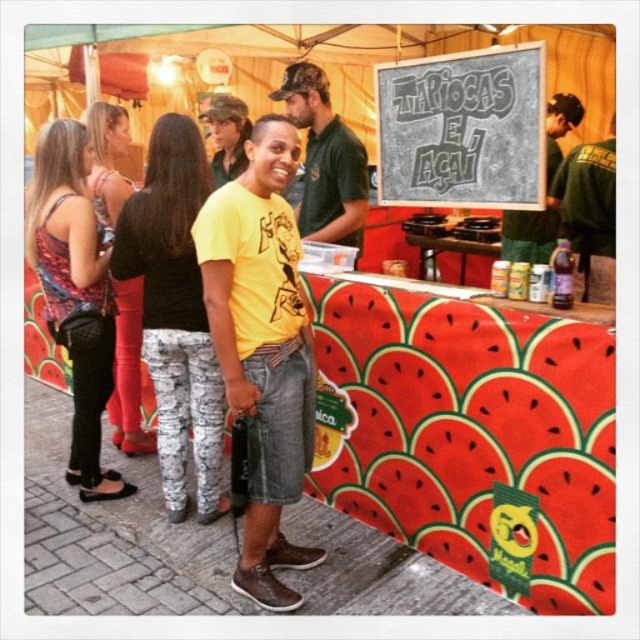
You are a customer at the food stall and want to read the chalkboard sign at upper center. However, there is a camouflage fabric cap at upper center in the way. Can you see the sign clearly?

The chalkboard sign at upper center is in front of the camouflage fabric cap at upper center, so you can see the sign clearly because it is not blocked by the cap.

You are a customer at the food stall and want to know which of the two points, point (240, 296) or point (458, 138), is closer to you. Can you determine this based on the scene?

Point (240, 296) is closer to the viewer than point (458, 138).

You are a customer at the food stall and want to read the chalkboard sign at upper center. However, there is a camouflage fabric cap at upper center blocking your view. Can you see the sign clearly?

The chalkboard sign at upper center is positioned under the camouflage fabric cap at upper center, so it is partially or fully hidden by the cap, making it difficult to read clearly.